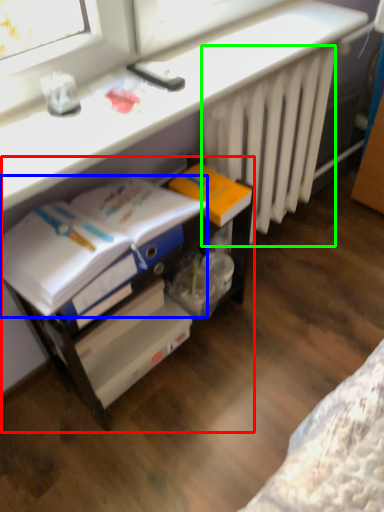
Question: Considering the real-world distances, which object is closest to file cabinet (highlighted by a red box)? magazine (highlighted by a blue box) or radiator (highlighted by a green box).

Choices:
 (A) magazine
 (B) radiator

Answer: (A)